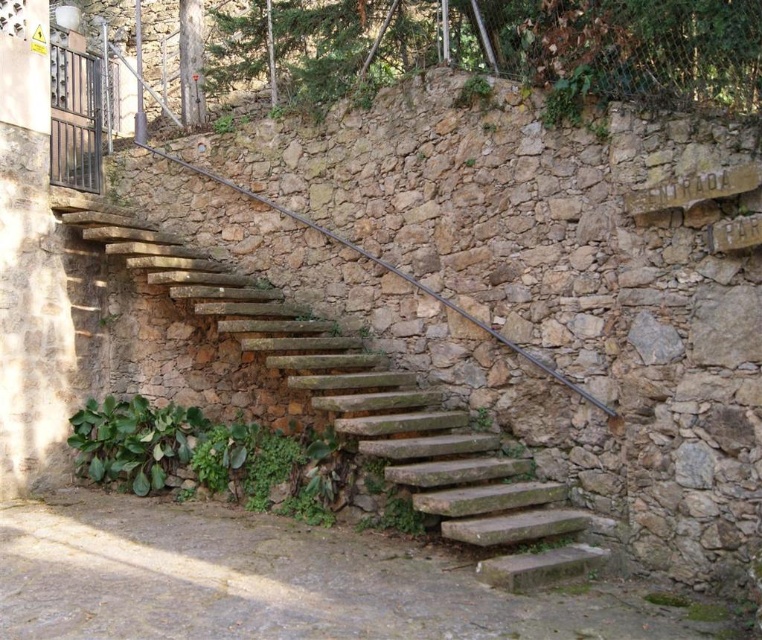
Is point (460, 442) less distant than point (411, 276)?

That is True.

Between rustic stone stairs at center and brown metal/rustic rail at center, which one has less height?

With less height is brown metal/rustic rail at center.

Is point (421, 477) positioned after point (501, 333)?

No, it is not.

Find the location of a particular element. The height and width of the screenshot is (640, 762). rustic stone stairs at center is located at coordinates (367, 406).

Looking at this image, can you confirm if green leafy ivy at upper center is positioned to the left of brown metal/rustic rail at center?

Incorrect, green leafy ivy at upper center is not on the left side of brown metal/rustic rail at center.

Who is taller, green leafy ivy at upper center or brown metal/rustic rail at center?

green leafy ivy at upper center is taller.

Locate an element on the screen. This screenshot has height=640, width=762. green leafy ivy at upper center is located at coordinates (530, 45).

Who is shorter, green leafy ivy at upper center or rustic stone stairs at center?

green leafy ivy at upper center is shorter.

Is the position of green leafy ivy at upper center less distant than that of rustic stone stairs at center?

No, green leafy ivy at upper center is further to the viewer.

Which is behind, point (391, 42) or point (555, 525)?

Point (391, 42)

You are a GUI agent. You are given a task and a screenshot of the screen. Output one action in this format:
    pyautogui.click(x=<x>, y=<y>)
    Task: Click on the green leafy ivy at upper center
    
    Given the screenshot: What is the action you would take?
    pyautogui.click(x=530, y=45)